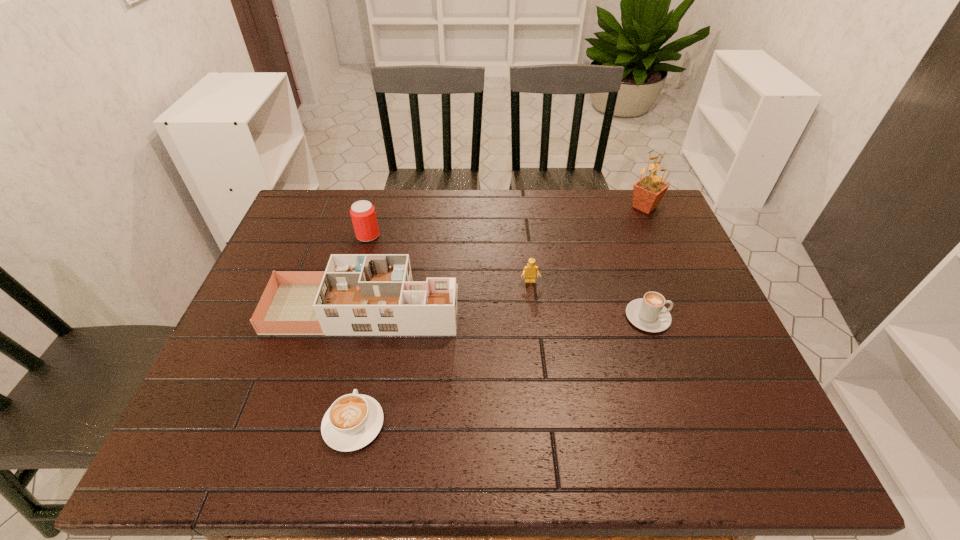
Identify the location of blank space located 0.370m at the front of the rightmost object with flowers visible. (516, 207).

In order to click on vacant space located at the front of the rightmost object with flowers visible in this screenshot , I will do `click(612, 207)`.

Find the location of a particular element. vacant area situated 0.340m at the front of the rightmost object with flowers visible is located at coordinates (525, 207).

This screenshot has height=540, width=960. What are the coordinates of `vacant space located 0.070m on the front of the beer can` in the screenshot? It's located at (362, 259).

At what (x,y) coordinates should I click in order to perform the action: click on vacant space positioned 0.220m at the entrance of the dollhouse. Please return your answer as a coordinate pair (x, y). Looking at the image, I should click on [541, 308].

The image size is (960, 540). I want to click on vacant space located on the face of the Lego, so click(x=541, y=384).

Where is `vacant space located to the right of the fifth tallest object`? The width and height of the screenshot is (960, 540). vacant space located to the right of the fifth tallest object is located at coordinates (689, 317).

Find the location of a particular element. free space located on the side of the nearer cappuccino with the handle is located at coordinates (366, 366).

You are a GUI agent. You are given a task and a screenshot of the screen. Output one action in this format:
    pyautogui.click(x=<x>, y=<y>)
    Task: Click on the free point located on the side of the nearer cappuccino with the handle
    
    Given the screenshot: What is the action you would take?
    pyautogui.click(x=370, y=352)

Identify the location of free space located on the side of the nearer cappuccino with the handle. (375, 323).